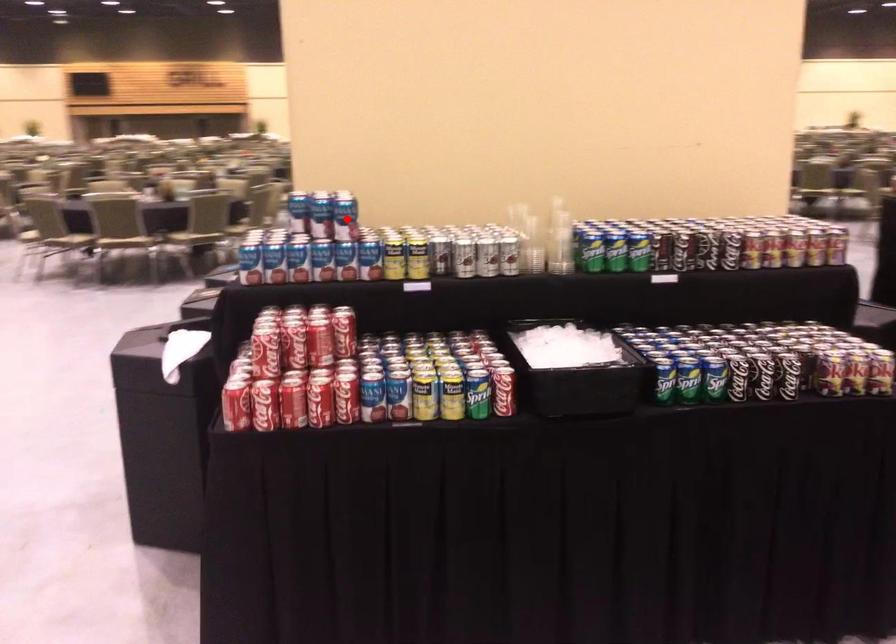
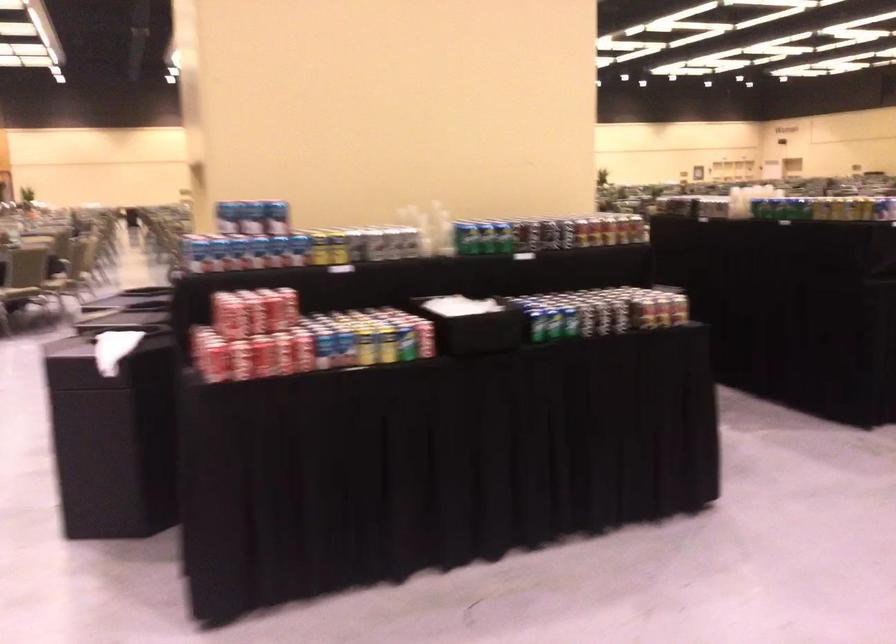
Where in the second image is the point corresponding to the highlighted location from the first image?

(277, 218)